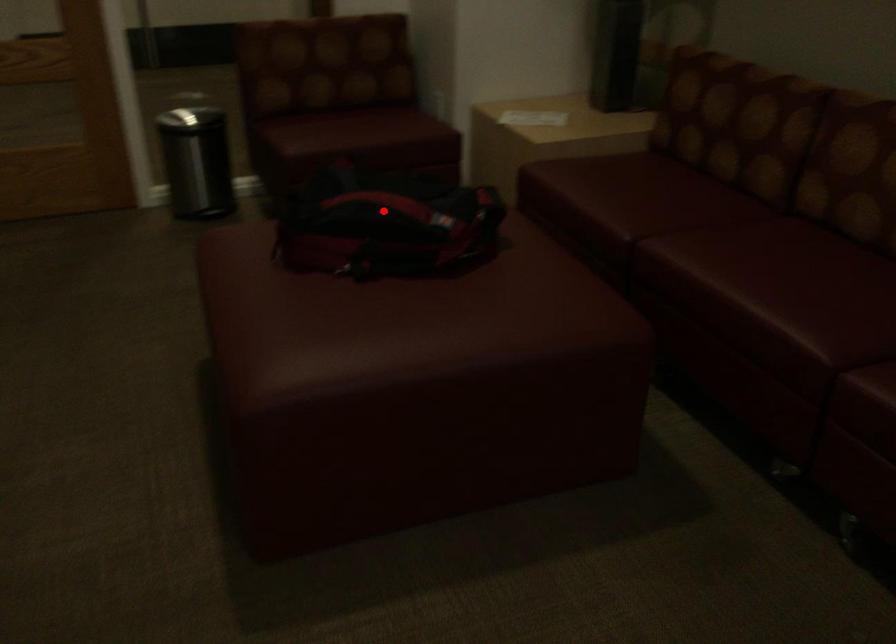
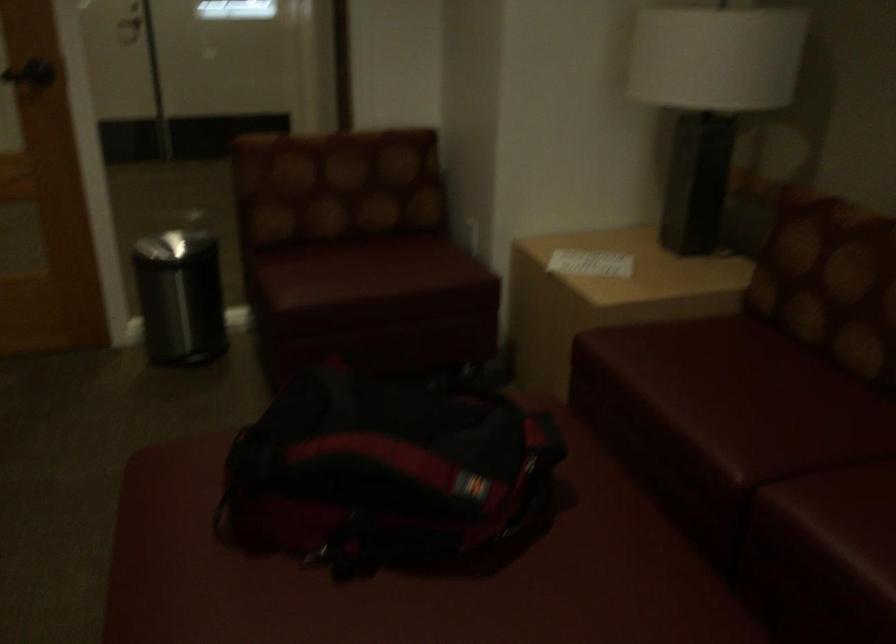
In the second image, find the point that corresponds to the highlighted location in the first image.

(384, 471)